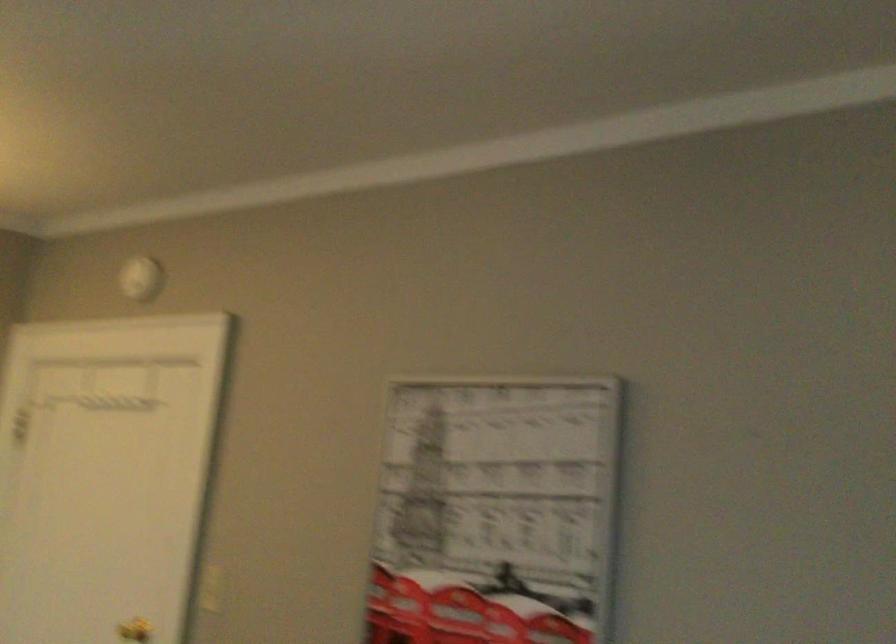
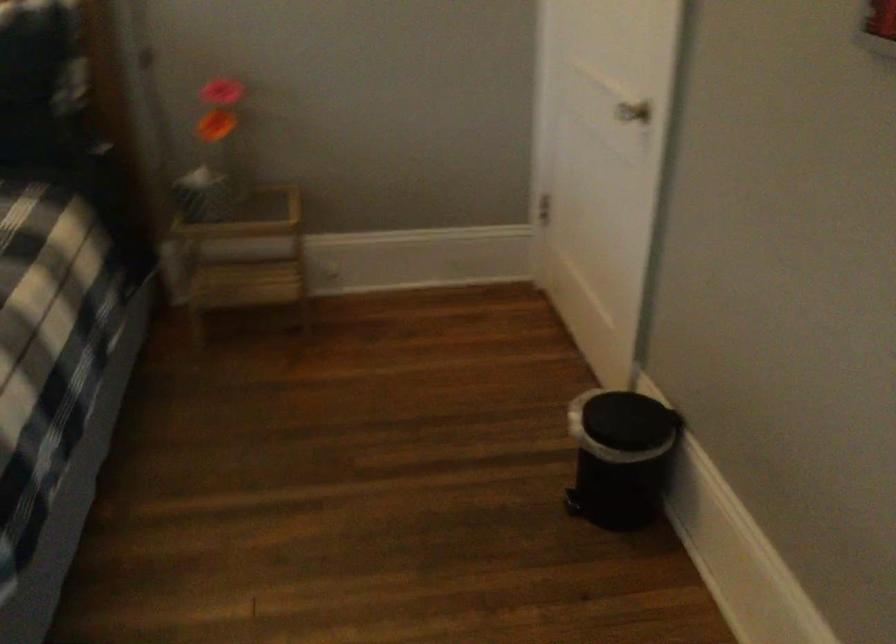
How did the camera likely rotate?

The camera rotated toward left-down.